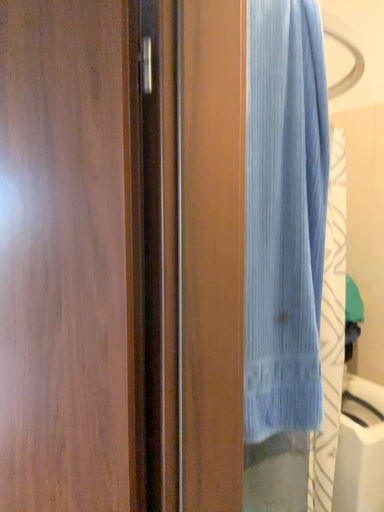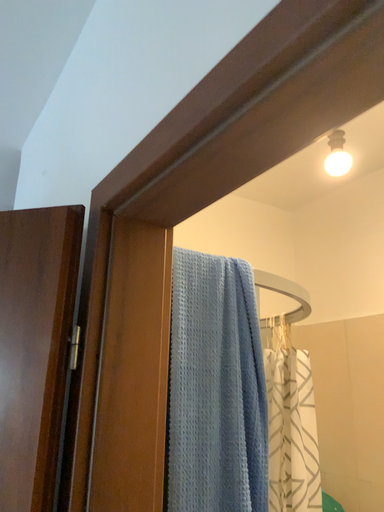
Question: Which way did the camera rotate in the video?

Choices:
 (A) rotated downward
 (B) rotated upward

Answer: (B)